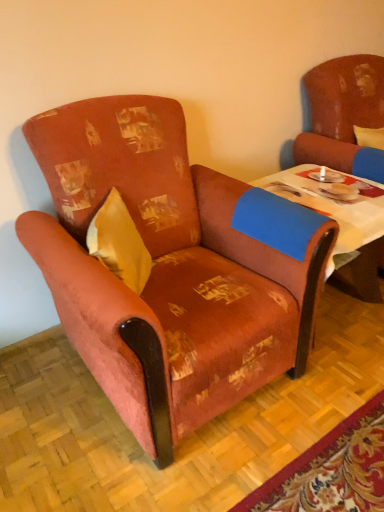
Question: Is yellow fabric pillow at left placed right next to textured orange armchair at left, the second chair from the right?

Choices:
 (A) no
 (B) yes

Answer: (A)

Question: Is yellow fabric pillow at left taller than textured orange armchair at left, the second chair from the right?

Choices:
 (A) no
 (B) yes

Answer: (A)

Question: Are yellow fabric pillow at left and textured orange armchair at left, which is the first chair from left to right, far apart?

Choices:
 (A) no
 (B) yes

Answer: (A)

Question: Considering the relative positions of yellow fabric pillow at left and textured orange armchair at left, which is the first chair from left to right, in the image provided, is yellow fabric pillow at left in front of textured orange armchair at left, which is the first chair from left to right,?

Choices:
 (A) no
 (B) yes

Answer: (A)

Question: From a real-world perspective, does yellow fabric pillow at left sit lower than textured orange armchair at left, the second chair from the right?

Choices:
 (A) no
 (B) yes

Answer: (A)

Question: Is yellow fabric pillow at left positioned with its back to textured orange armchair at left, the second chair from the right?

Choices:
 (A) yes
 (B) no

Answer: (A)

Question: Is yellow fabric pillow at left looking in the opposite direction of blue fabric table at center?

Choices:
 (A) yes
 (B) no

Answer: (B)

Question: Does yellow fabric pillow at left have a smaller size compared to blue fabric table at center?

Choices:
 (A) no
 (B) yes

Answer: (B)

Question: Is yellow fabric pillow at left taller than blue fabric table at center?

Choices:
 (A) no
 (B) yes

Answer: (B)

Question: From the image's perspective, is yellow fabric pillow at left over blue fabric table at center?

Choices:
 (A) no
 (B) yes

Answer: (A)

Question: Does yellow fabric pillow at left appear on the left side of blue fabric table at center?

Choices:
 (A) no
 (B) yes

Answer: (B)

Question: Considering the relative sizes of yellow fabric pillow at left and blue fabric table at center in the image provided, is yellow fabric pillow at left bigger than blue fabric table at center?

Choices:
 (A) yes
 (B) no

Answer: (B)

Question: Is textured orange armchair at left, the second chair from the right, taller than blue fabric table at center?

Choices:
 (A) yes
 (B) no

Answer: (A)